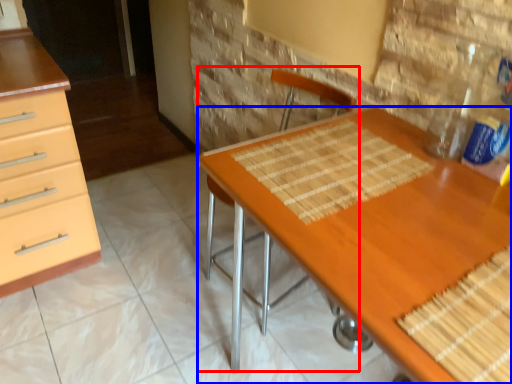
Question: Among these objects, which one is farthest to the camera, armchair (highlighted by a red box) or desk (highlighted by a blue box)?

Choices:
 (A) armchair
 (B) desk

Answer: (A)